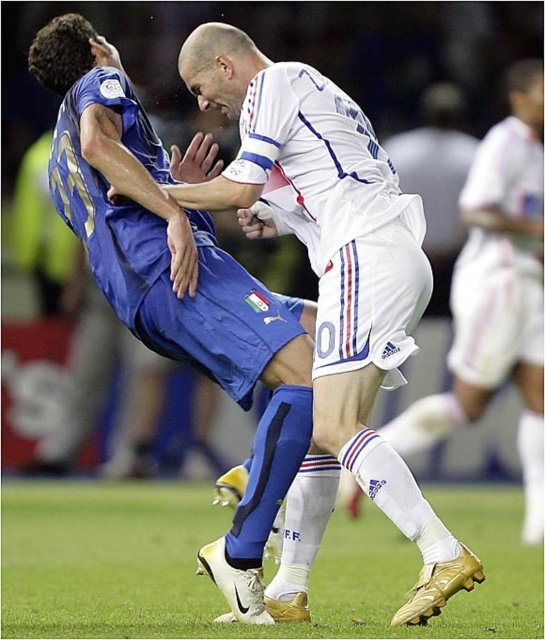
Measure the distance between white smooth soccer player at center and camera.

They are 3.78 meters apart.

Can you confirm if white smooth soccer player at center is wider than blue fabric jersey at center?

Incorrect, white smooth soccer player at center's width does not surpass blue fabric jersey at center's.

The width and height of the screenshot is (545, 640). In order to click on white smooth soccer player at center in this screenshot , I will do `click(330, 289)`.

Locate an element on the screen. white smooth soccer player at center is located at coordinates (330, 289).

Which is behind, point (8, 593) or point (529, 536)?

Positioned behind is point (529, 536).

Does green grass at center have a greater height compared to white smooth shorts at center?

Incorrect, green grass at center's height is not larger of white smooth shorts at center's.

Who is more forward, (161, 540) or (525, 429)?

Point (525, 429) is more forward.

This screenshot has width=545, height=640. I want to click on green grass at center, so click(214, 586).

Does blue fabric jersey at center have a greater height compared to green grass at center?

Correct, blue fabric jersey at center is much taller as green grass at center.

Can you confirm if blue fabric jersey at center is thinner than green grass at center?

Incorrect, blue fabric jersey at center's width is not less than green grass at center's.

You are a GUI agent. You are given a task and a screenshot of the screen. Output one action in this format:
    pyautogui.click(x=<x>, y=<y>)
    Task: Click on the blue fabric jersey at center
    The image size is (545, 640).
    Given the screenshot: What is the action you would take?
    pyautogui.click(x=177, y=280)